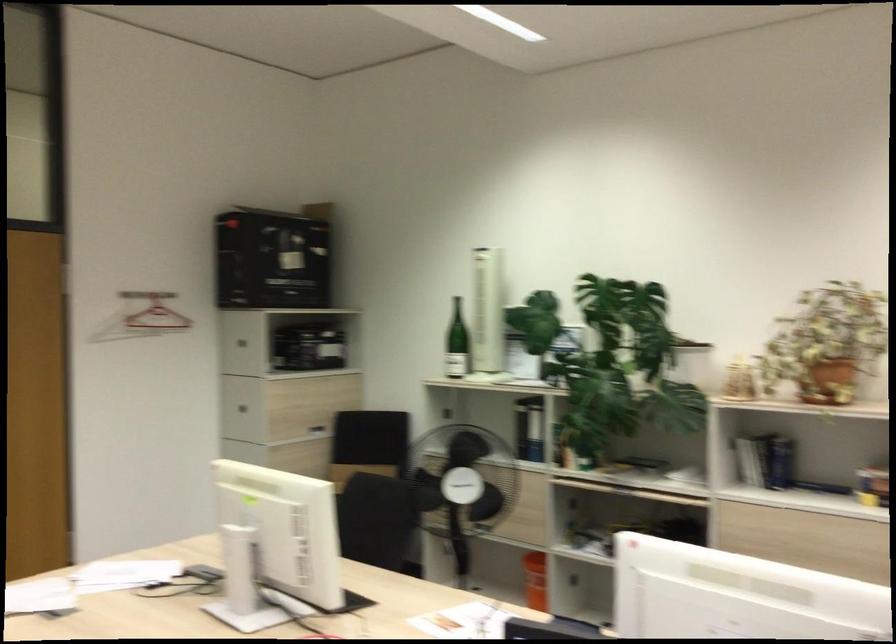
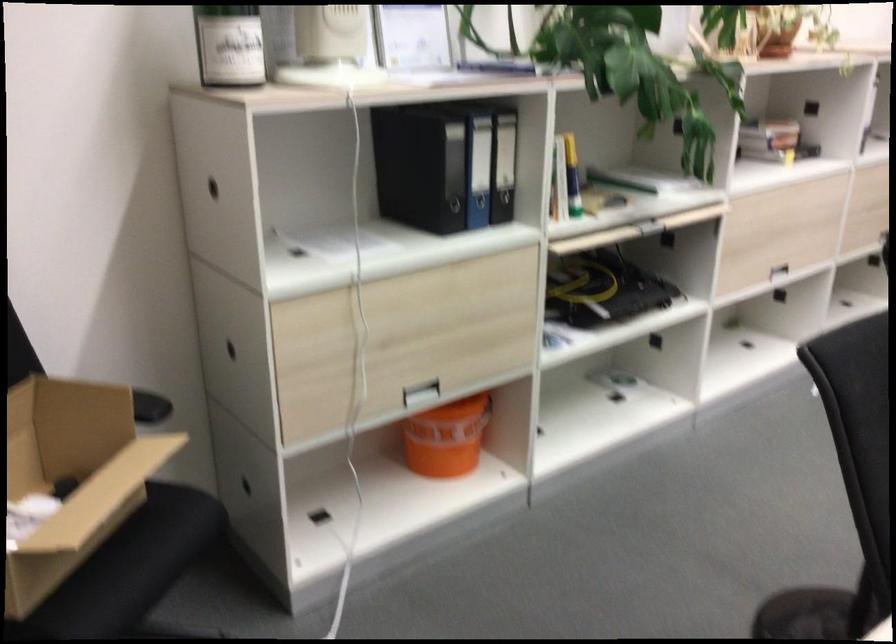
Find the pixel in the second image that matches pixel 460 357 in the first image.

(229, 44)